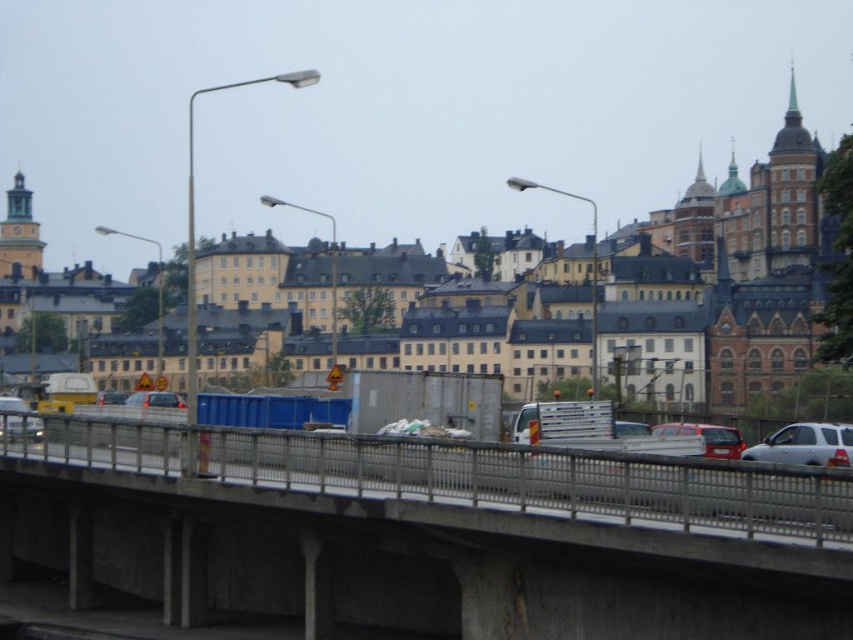
Question: Among these objects, which one is farthest from the camera?

Choices:
 (A) silver metallic car at lower right
 (B) metallic silver car at center

Answer: (B)

Question: In this image, where is concrete bridge at center located relative to matte silver car at center?

Choices:
 (A) left
 (B) right

Answer: (B)

Question: Is silver metallic car at lower right smaller than metallic silver car at center?

Choices:
 (A) yes
 (B) no

Answer: (B)

Question: Can you confirm if matte red car at center is positioned below matte silver car at center?

Choices:
 (A) yes
 (B) no

Answer: (A)

Question: Which object is farther from the camera taking this photo?

Choices:
 (A) matte silver car at center
 (B) matte red car at center
 (C) silver metallic car at lower right
 (D) metallic silver car at center

Answer: (A)

Question: Which is nearer to the metallic silver car at center?

Choices:
 (A) concrete bridge at center
 (B) matte red car at center
 (C) matte silver car at center

Answer: (C)